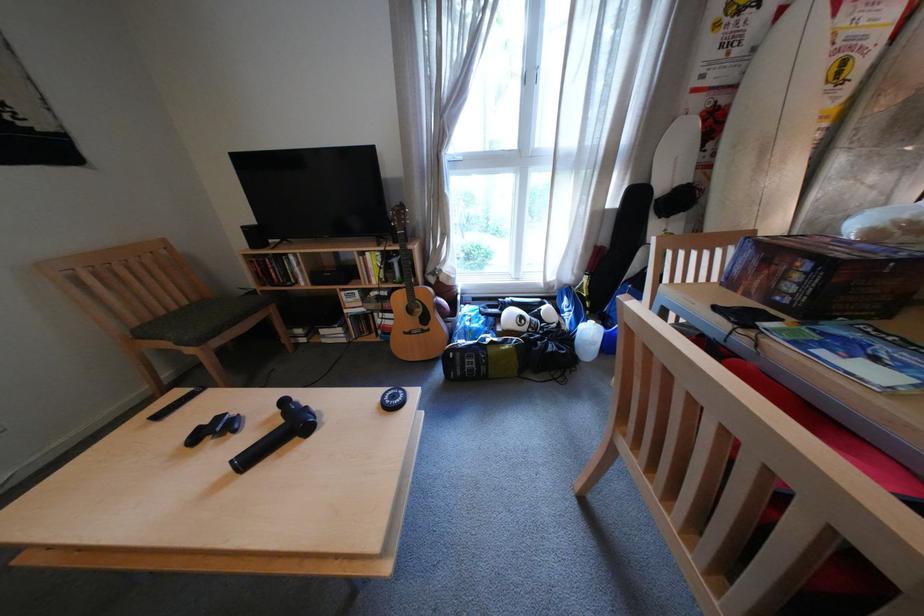
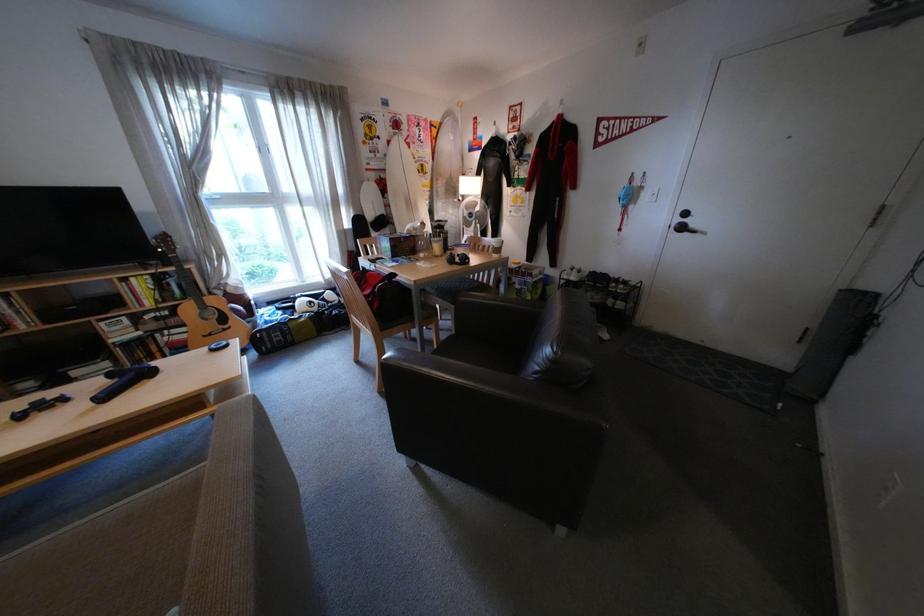
Locate, in the second image, the point that corresponds to (748,53) in the first image.

(392, 156)